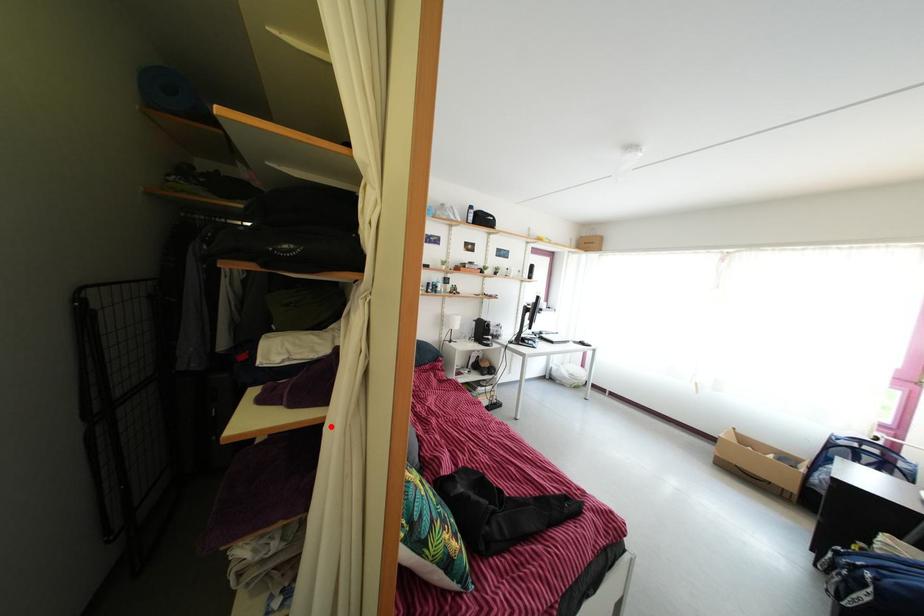
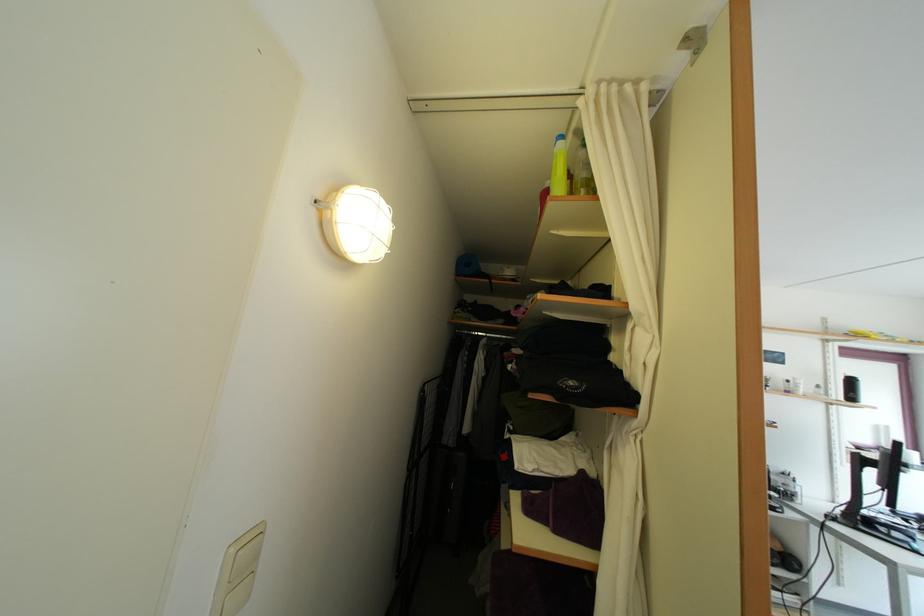
The point at the highlighted location is marked in the first image. Where is the corresponding point in the second image?

(602, 576)